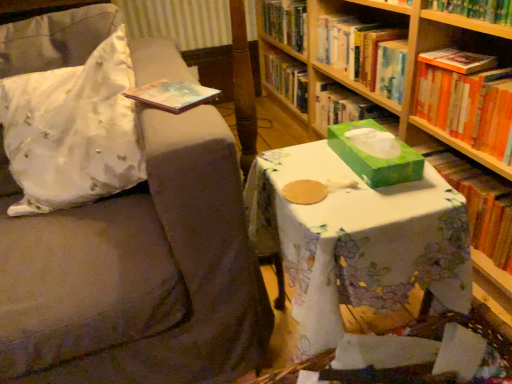
Question: Can you confirm if green paper book at right, which ranks as the 1th book in bottom-to-top order, is bigger than orange hardcover book at right, the second book positioned from the bottom?

Choices:
 (A) no
 (B) yes

Answer: (B)

Question: Considering the relative sizes of green paper book at right, arranged as the 3th book when viewed from the top, and orange hardcover book at right, the second book positioned from the bottom, in the image provided, is green paper book at right, arranged as the 3th book when viewed from the top, shorter than orange hardcover book at right, the second book positioned from the bottom,?

Choices:
 (A) no
 (B) yes

Answer: (A)

Question: Is green paper book at right, arranged as the 3th book when viewed from the top, positioned before orange hardcover book at right, placed as the 2th book when sorted from top to bottom?

Choices:
 (A) yes
 (B) no

Answer: (B)

Question: Considering the relative sizes of green paper book at right, which ranks as the 1th book in bottom-to-top order, and orange hardcover book at right, the second book positioned from the bottom, in the image provided, is green paper book at right, which ranks as the 1th book in bottom-to-top order, thinner than orange hardcover book at right, the second book positioned from the bottom,?

Choices:
 (A) yes
 (B) no

Answer: (A)

Question: Is green paper book at right, which ranks as the 1th book in bottom-to-top order, not close to orange hardcover book at right, placed as the 2th book when sorted from top to bottom?

Choices:
 (A) yes
 (B) no

Answer: (B)

Question: From the image's perspective, relative to hardcover book at upper right, which appears as the 3th book when ordered from the bottom, is orange hardcover book at right, the second book positioned from the bottom, above or below?

Choices:
 (A) above
 (B) below

Answer: (B)

Question: From a real-world perspective, is orange hardcover book at right, the second book positioned from the bottom, positioned above or below hardcover book at upper right, the 1th book positioned from the top?

Choices:
 (A) below
 (B) above

Answer: (A)

Question: Visually, is orange hardcover book at right, the second book positioned from the bottom, positioned to the left or to the right of hardcover book at upper right, which appears as the 3th book when ordered from the bottom?

Choices:
 (A) left
 (B) right

Answer: (B)

Question: Looking at the image, does orange hardcover book at right, the second book positioned from the bottom, seem bigger or smaller compared to hardcover book at upper right, the 1th book positioned from the top?

Choices:
 (A) big
 (B) small

Answer: (B)

Question: Do you think orange hardcover book at right, placed as the 2th book when sorted from top to bottom, is within green cardboard bookcase at center, or outside of it?

Choices:
 (A) inside
 (B) outside

Answer: (A)

Question: In terms of size, does orange hardcover book at right, the second book positioned from the bottom, appear bigger or smaller than green cardboard bookcase at center?

Choices:
 (A) small
 (B) big

Answer: (A)

Question: Relative to green cardboard bookcase at center, is orange hardcover book at right, the second book positioned from the bottom, in front or behind?

Choices:
 (A) behind
 (B) front

Answer: (A)

Question: In terms of height, does orange hardcover book at right, the second book positioned from the bottom, look taller or shorter compared to green cardboard bookcase at center?

Choices:
 (A) short
 (B) tall

Answer: (A)

Question: From their relative heights in the image, would you say orange hardcover book at right, the second book positioned from the bottom, is taller or shorter than green paper book at right, which ranks as the 1th book in bottom-to-top order?

Choices:
 (A) tall
 (B) short

Answer: (B)

Question: From the image's perspective, is orange hardcover book at right, the second book positioned from the bottom, located above or below green paper book at right, which ranks as the 1th book in bottom-to-top order?

Choices:
 (A) above
 (B) below

Answer: (A)